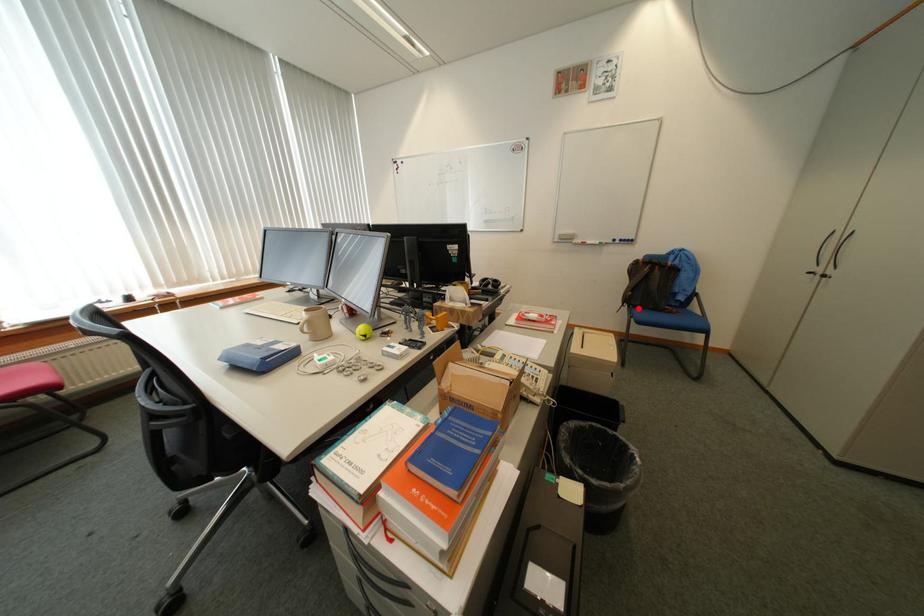
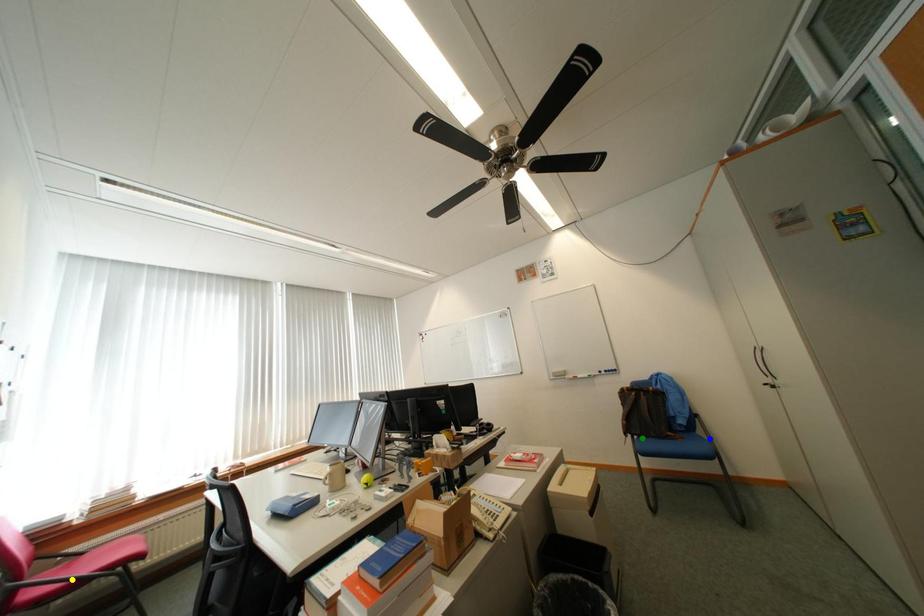
Question: I am providing you with two images of the same scene from different viewpoints. A red point is marked on the first image. You are given multiple points on the second image. Which mark in image 2 goes with the point in image 1?

Choices:
 (A) blue point
 (B) yellow point
 (C) green point

Answer: (C)